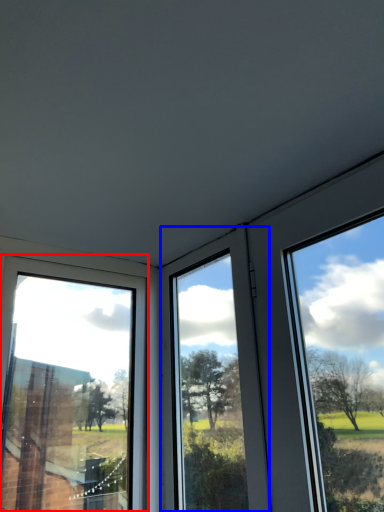
Question: Which of the following is the farthest to the observer, window (highlighted by a red box) or window (highlighted by a blue box)?

Choices:
 (A) window
 (B) window

Answer: (B)